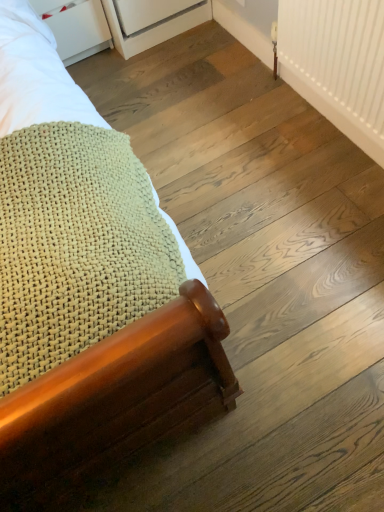
The image size is (384, 512). Identify the location of spots to the right of wooden bed frame at lower left. (228, 166).